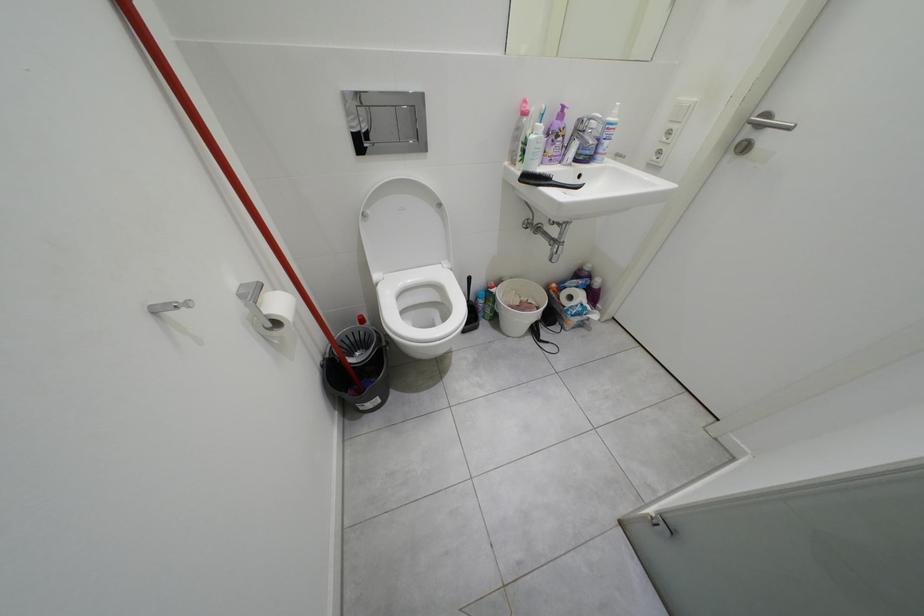
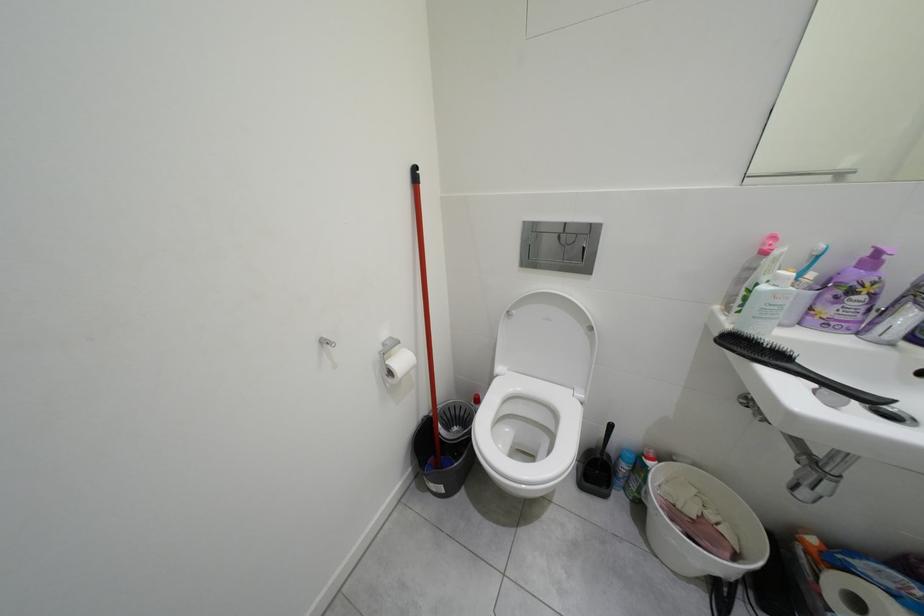
Question: The camera is either moving clockwise (left) or counter-clockwise (right) around the object. The first image is from the beginning of the video and the second image is from the end. Is the camera moving left or right when shooting the video?

Choices:
 (A) Left
 (B) Right

Answer: (B)